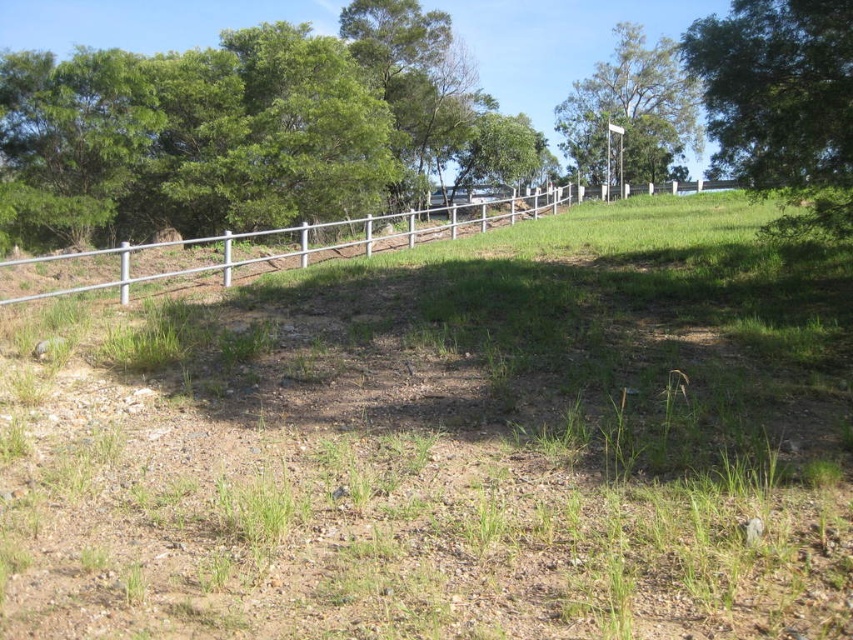
Question: Considering the real-world distances, which object is farthest from the green leafy tree at upper right?

Choices:
 (A) green leafy tree at upper center
 (B) silver metallic fence at upper center

Answer: (B)

Question: Does silver metallic fence at upper center appear on the left side of green leafy tree at upper center?

Choices:
 (A) no
 (B) yes

Answer: (B)

Question: Which is nearer to the silver metallic fence at upper center?

Choices:
 (A) green leafy tree at upper right
 (B) green leafy tree at upper center

Answer: (A)

Question: Considering the real-world distances, which object is farthest from the green leafy tree at upper right?

Choices:
 (A) silver metallic fence at upper center
 (B) green leafy tree at upper center

Answer: (A)

Question: Is green leafy tree at upper right below green leafy tree at upper center?

Choices:
 (A) yes
 (B) no

Answer: (A)

Question: Is green leafy tree at upper right to the right of silver metallic fence at upper center from the viewer's perspective?

Choices:
 (A) yes
 (B) no

Answer: (A)